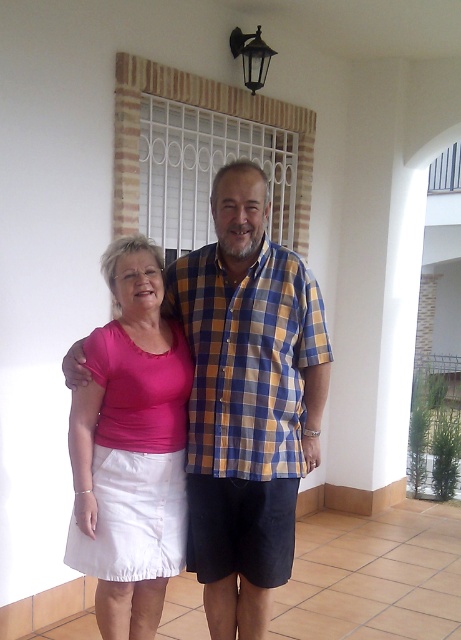
Is pink cotton shirt at center thinner than pink fabric skirt at lower left?

No, pink cotton shirt at center is not thinner than pink fabric skirt at lower left.

Does point (261, 330) come in front of point (106, 561)?

No.

Between point (247, 305) and point (113, 609), which one is positioned in front?

Point (113, 609) is more forward.

Image resolution: width=461 pixels, height=640 pixels. What are the coordinates of `pink cotton shirt at center` in the screenshot? It's located at (247, 401).